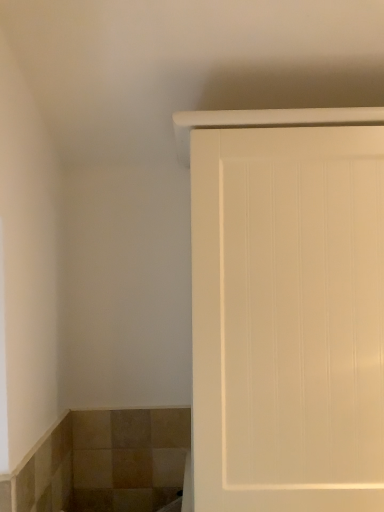
You are a GUI agent. You are given a task and a screenshot of the screen. Output one action in this format:
    pyautogui.click(x=<x>, y=<y>)
    Task: Click on the white matte door at upper right
    The width and height of the screenshot is (384, 512).
    Given the screenshot: What is the action you would take?
    pyautogui.click(x=288, y=318)

This screenshot has height=512, width=384. Describe the element at coordinates (288, 318) in the screenshot. I see `white matte door at upper right` at that location.

Where is `white matte door at upper right`? This screenshot has width=384, height=512. white matte door at upper right is located at coordinates (288, 318).